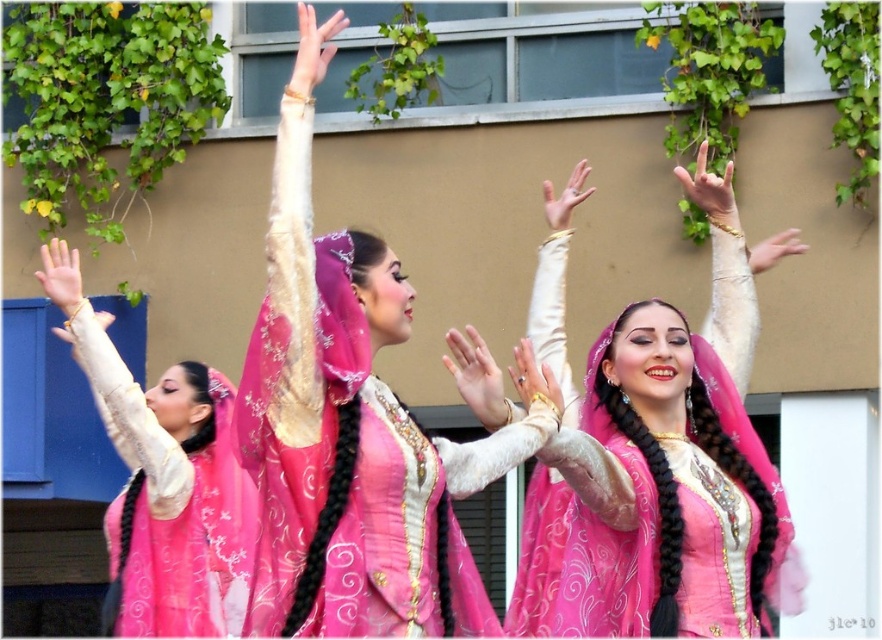
Question: In this image, where is matte gold bracelet at upper right located relative to matte gold bracelet at left?

Choices:
 (A) left
 (B) right

Answer: (B)

Question: Is matte pink fabric hand at upper center below matte gold hand at left?

Choices:
 (A) yes
 (B) no

Answer: (B)

Question: Does smooth cream hand at upper center have a lesser width compared to matte gold ring at center?

Choices:
 (A) yes
 (B) no

Answer: (B)

Question: Which of the following is the farthest from the observer?

Choices:
 (A) (65, 275)
 (B) (723, 218)

Answer: (A)

Question: Which point is farther to the camera?

Choices:
 (A) matte gold bracelet at upper center
 (B) matte gold bracelet at left
 (C) matte gold hand at left

Answer: (B)

Question: Which of the following is the farthest from the observer?

Choices:
 (A) matte pink dress at left
 (B) matte gold hand at left
 (C) matte gold bracelet at left
 (D) matte pink fabric hand at upper center

Answer: (C)